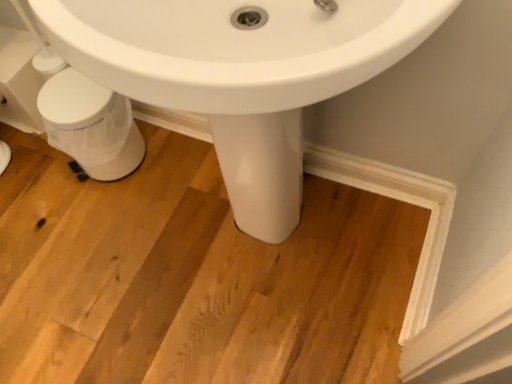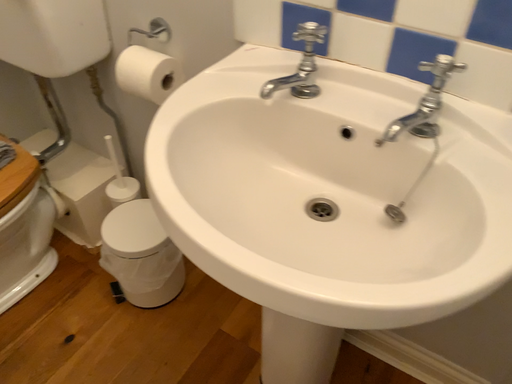
Question: How did the camera likely rotate when shooting the video?

Choices:
 (A) rotated upward
 (B) rotated downward

Answer: (A)